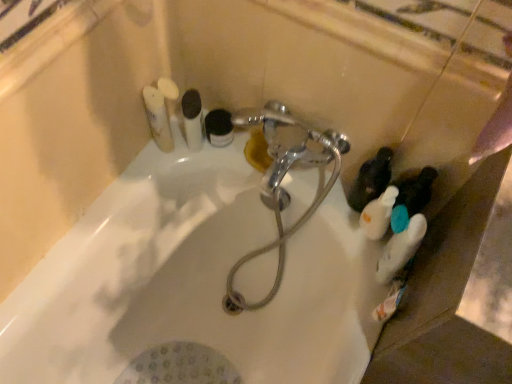
Question: In terms of width, does white matte toothpaste tube at upper left, arranged as the first toiletry when viewed from the left, look wider or thinner when compared to chrome metallic faucet at center?

Choices:
 (A) wide
 (B) thin

Answer: (B)

Question: Is white matte toothpaste tube at upper left, arranged as the first toiletry when viewed from the left, taller or shorter than chrome metallic faucet at center?

Choices:
 (A) tall
 (B) short

Answer: (B)

Question: Estimate the real-world distances between objects in this image. Which object is farther from the white glossy tube at upper center, which is counted as the third toiletry, starting from the left?

Choices:
 (A) black matte jar at upper center, the 4th toiletry from the left
 (B) white matte toothbrushes at upper left, arranged as the 5th toiletry when viewed from the right
 (C) chrome metallic faucet at center
 (D) white matte bottle at right, which is the sixth toiletry from left to right
 (E) white glossy bathtub at center

Answer: (D)

Question: Which of these objects is positioned closest to the white matte toothbrushes at upper left, arranged as the 5th toiletry when viewed from the right?

Choices:
 (A) white matte toothpaste tube at upper left, arranged as the first toiletry when viewed from the left
 (B) chrome metallic faucet at center
 (C) white matte bottle at lower right
 (D) black matte jar at upper center, the 4th toiletry from the left
 (E) white glossy tube at upper center, the fourth toiletry from the right

Answer: (A)